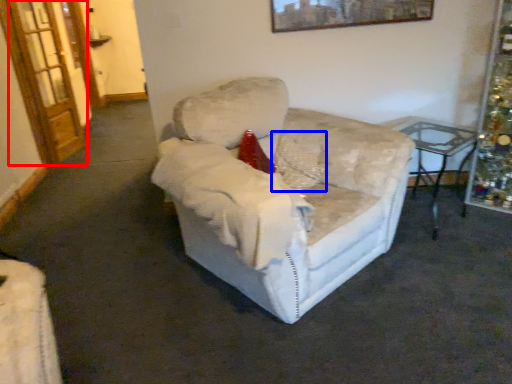
Question: Among these objects, which one is nearest to the camera, glass door (highlighted by a red box) or pillow (highlighted by a blue box)?

Choices:
 (A) glass door
 (B) pillow

Answer: (B)